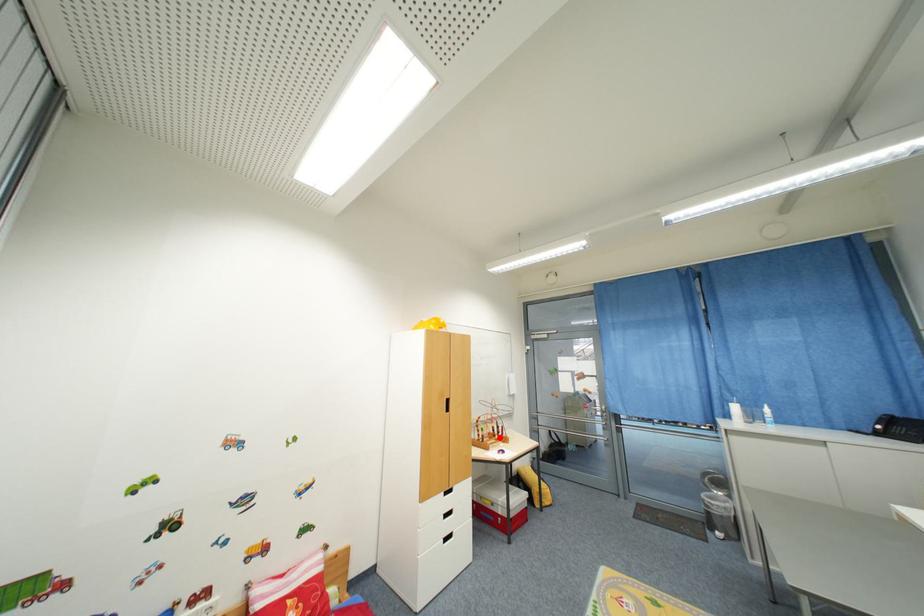
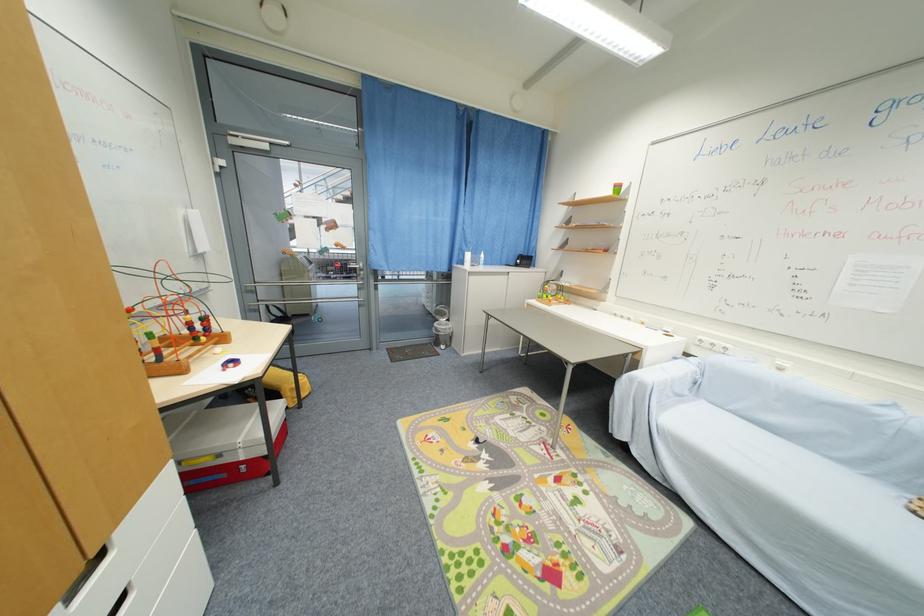
Question: I am providing you with two images of the same scene from different viewpoints. A red point is shown in image1. For the corresponding object point in image2, is it positioned nearer or farther from the camera?

Choices:
 (A) Nearer
 (B) Farther

Answer: (A)